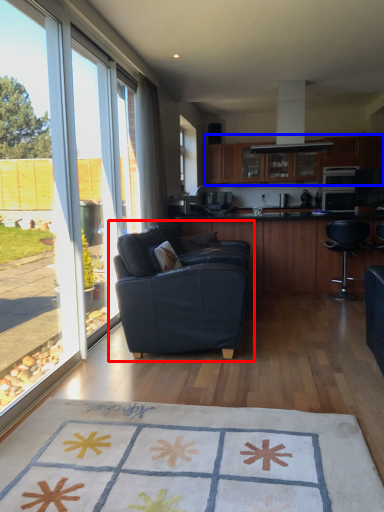
Question: Which point is closer to the camera, studio couch (highlighted by a red box) or cabinetry (highlighted by a blue box)?

Choices:
 (A) studio couch
 (B) cabinetry

Answer: (A)